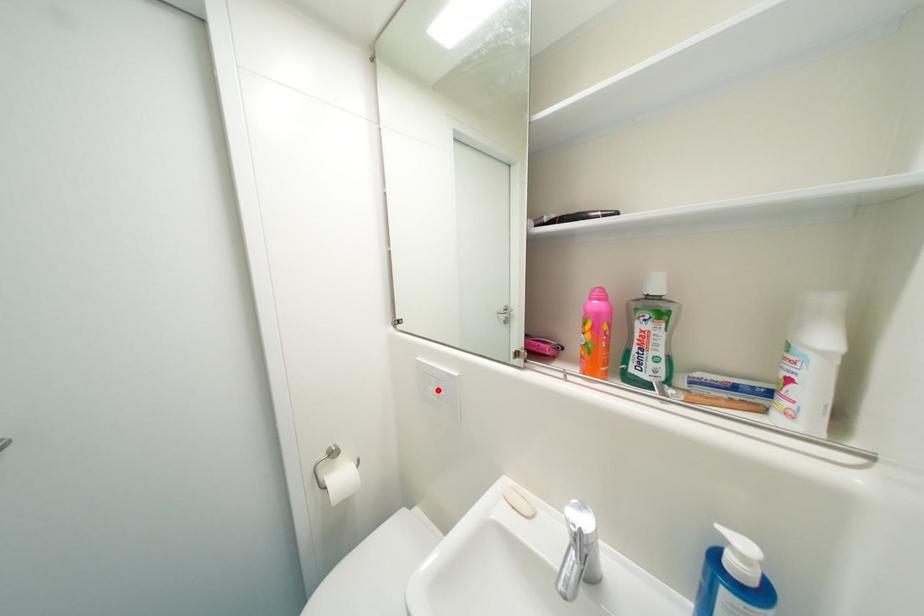
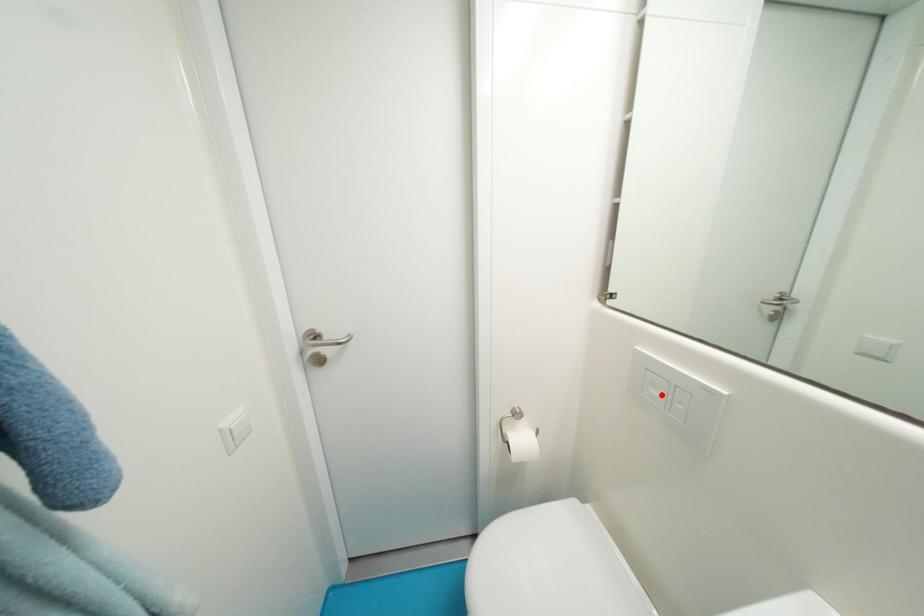
I am providing you with two images of the same scene from different viewpoints. A red point is marked on the first image and another point is marked on the second image. Do the highlighted points in image1 and image2 indicate the same real-world spot?

Yes